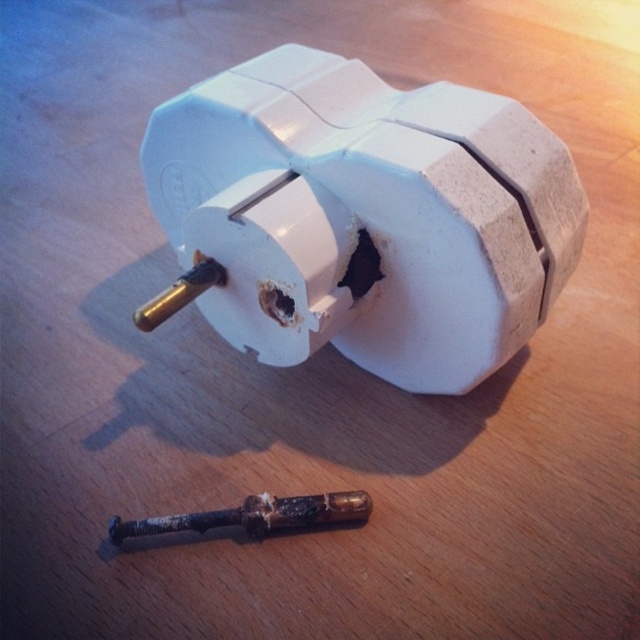
Question: Which point is farther to the camera?

Choices:
 (A) (131, 532)
 (B) (488, 292)

Answer: (A)

Question: Does white plastic plug at center appear under rusty metallic screwdriver at lower center?

Choices:
 (A) no
 (B) yes

Answer: (A)

Question: Is white plastic plug at center above rusty metallic screwdriver at lower center?

Choices:
 (A) no
 (B) yes

Answer: (B)

Question: Which point appears farthest from the camera in this image?

Choices:
 (A) (109, 536)
 (B) (579, 241)

Answer: (B)

Question: Is white plastic plug at center positioned in front of rusty metallic screwdriver at lower center?

Choices:
 (A) yes
 (B) no

Answer: (A)